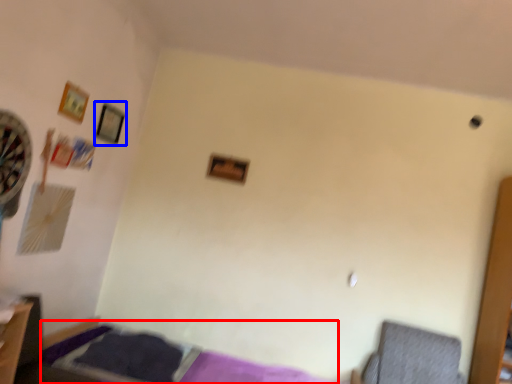
Question: Among these objects, which one is farthest to the camera, bed (highlighted by a red box) or picture frame (highlighted by a blue box)?

Choices:
 (A) bed
 (B) picture frame

Answer: (B)